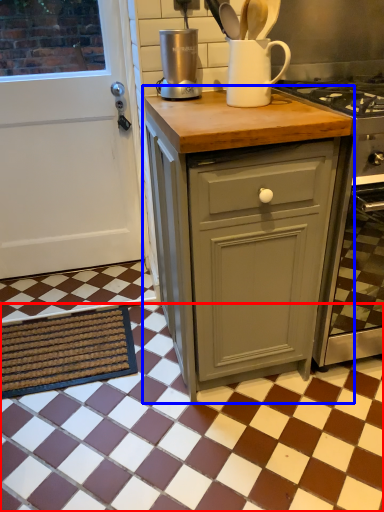
Question: Which point is further to the camera, tile (highlighted by a red box) or cabinetry (highlighted by a blue box)?

Choices:
 (A) tile
 (B) cabinetry

Answer: (B)